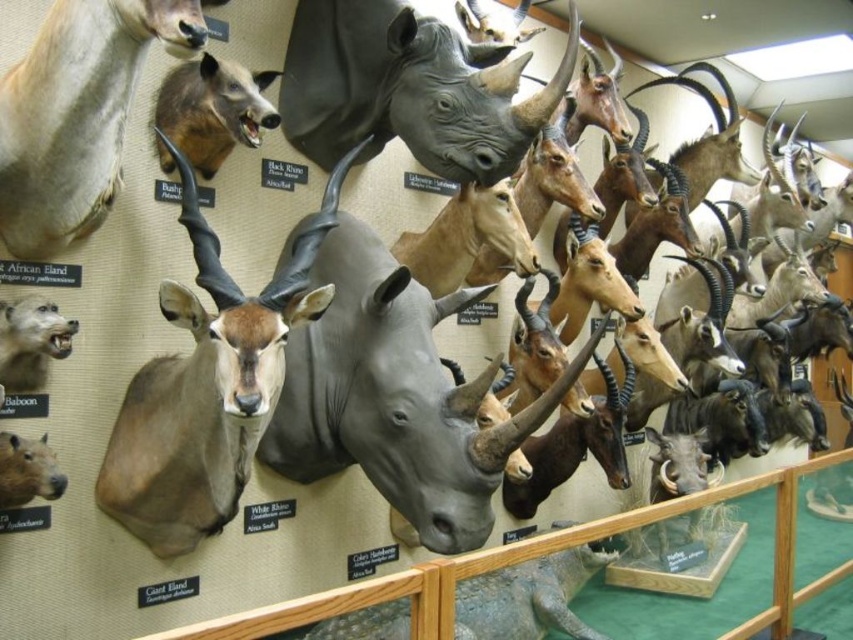
Is the position of matte gray rhinoceros at center more distant than that of black matte rhinoceros at center?

No, it is in front of black matte rhinoceros at center.

Does matte gray rhinoceros at center have a smaller size compared to black matte rhinoceros at center?

No.

Between point (296, 355) and point (497, 76), which one is positioned behind?

Point (296, 355)

The image size is (853, 640). Identify the location of matte gray rhinoceros at center. (x=392, y=388).